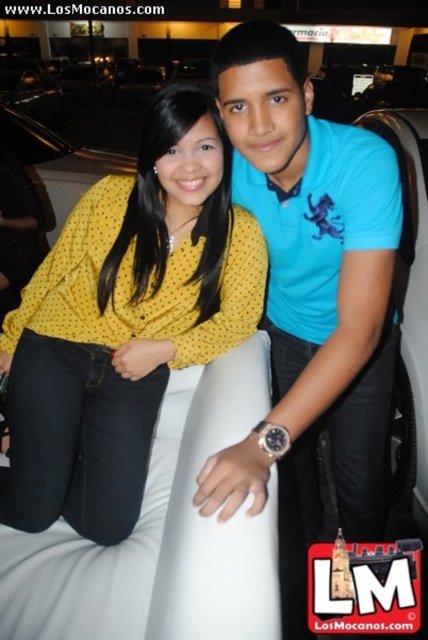
Locate an element on the screen. The image size is (428, 640). yellow dotted shirt at center is located at coordinates (124, 323).

Between yellow dotted shirt at center and blue cotton shirt at center, which one has more height?

blue cotton shirt at center

Between point (32, 468) and point (347, 435), which one is positioned behind?

The point (347, 435) is more distant.

Identify the location of yellow dotted shirt at center. (124, 323).